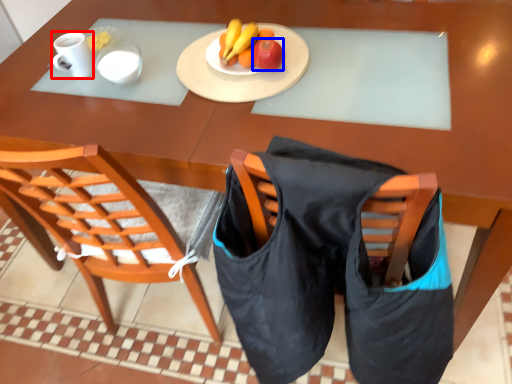
Question: Which point is further to the camera, coffee cup (highlighted by a red box) or apple (highlighted by a blue box)?

Choices:
 (A) coffee cup
 (B) apple

Answer: (A)